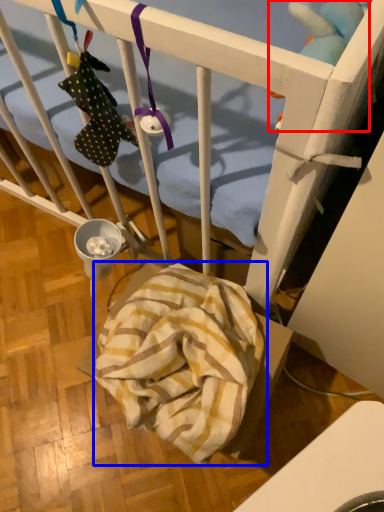
Question: Among these objects, which one is farthest to the camera, toy (highlighted by a red box) or blanket (highlighted by a blue box)?

Choices:
 (A) toy
 (B) blanket

Answer: (B)